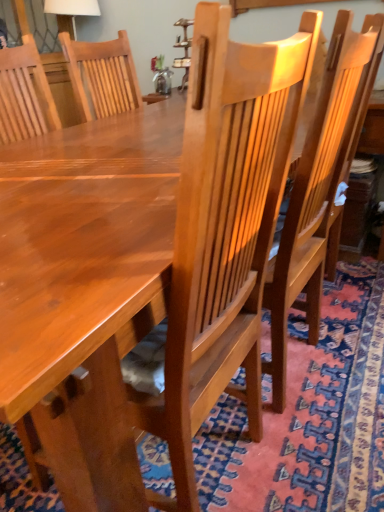
The width and height of the screenshot is (384, 512). Describe the element at coordinates (310, 415) in the screenshot. I see `carpeted floor at center` at that location.

Where is `carpeted floor at center`? This screenshot has height=512, width=384. carpeted floor at center is located at coordinates (310, 415).

This screenshot has width=384, height=512. Identify the location of glossy wood chair at center. (314, 196).

What do you see at coordinates (314, 196) in the screenshot?
I see `glossy wood chair at center` at bounding box center [314, 196].

Locate an element on the screen. The height and width of the screenshot is (512, 384). carpeted floor at center is located at coordinates click(x=310, y=415).

Is glossy wood chair at center to the left or to the right of carpeted floor at center in the image?

glossy wood chair at center is to the right of carpeted floor at center.

Which object is more forward, glossy wood chair at center or carpeted floor at center?

carpeted floor at center is closer to the camera.

Does point (279, 343) lie behind point (286, 500)?

Yes, it is.

In the scene shown: From the image's perspective, which is above, glossy wood chair at center or carpeted floor at center?

glossy wood chair at center is shown above in the image.

From a real-world perspective, is glossy wood chair at center over carpeted floor at center?

Yes.

Is glossy wood chair at center wider than carpeted floor at center?

No.

Between glossy wood chair at center and carpeted floor at center, which one has more height?

glossy wood chair at center.

Can you confirm if glossy wood chair at center is bigger than carpeted floor at center?

Actually, glossy wood chair at center might be smaller than carpeted floor at center.

Is carpeted floor at center completely or partially inside glossy wood chair at center?

No, carpeted floor at center is not inside glossy wood chair at center.

Are glossy wood chair at center and carpeted floor at center located far from each other?

No.

Is glossy wood chair at center positioned with its back to carpeted floor at center?

Yes.

In the scene shown: Can you tell me how much glossy wood chair at center and carpeted floor at center differ in facing direction?

The angle between the facing direction of glossy wood chair at center and the facing direction of carpeted floor at center is 87.7 degrees.

How far apart are glossy wood chair at center and carpeted floor at center?

They are 36.79 centimeters apart.

This screenshot has width=384, height=512. I want to click on chair lying above the carpeted floor at center (from the image's perspective), so click(314, 196).

From the picture: Considering the relative positions of carpeted floor at center and glossy wood chair at center in the image provided, is carpeted floor at center to the left of glossy wood chair at center from the viewer's perspective?

Yes.

Does carpeted floor at center lie behind glossy wood chair at center?

No, carpeted floor at center is closer to the camera.

Which is in front, point (368, 438) or point (297, 286)?

The point (368, 438) is closer.

From the image's perspective, between carpeted floor at center and glossy wood chair at center, which one is located above?

glossy wood chair at center appears higher in the image.

From a real-world perspective, who is located lower, carpeted floor at center or glossy wood chair at center?

In real-world perspective, carpeted floor at center is lower.

Looking at their sizes, would you say carpeted floor at center is wider or thinner than glossy wood chair at center?

In the image, carpeted floor at center appears to be wider than glossy wood chair at center.

Is carpeted floor at center taller than glossy wood chair at center?

No.

Between carpeted floor at center and glossy wood chair at center, which one has smaller size?

Smaller between the two is glossy wood chair at center.

Can glossy wood chair at center be found inside carpeted floor at center?

That's correct, glossy wood chair at center is inside carpeted floor at center.

Are carpeted floor at center and glossy wood chair at center beside each other?

carpeted floor at center and glossy wood chair at center are not in contact.

Is carpeted floor at center facing away from glossy wood chair at center?

No, carpeted floor at center's orientation is not away from glossy wood chair at center.

Measure the distance between carpeted floor at center and glossy wood chair at center.

The distance of carpeted floor at center from glossy wood chair at center is 14.48 inches.

You are a GUI agent. You are given a task and a screenshot of the screen. Output one action in this format:
    pyautogui.click(x=<x>, y=<y>)
    Task: Click on the chair located above the carpeted floor at center (from the image's perspective)
    The height and width of the screenshot is (512, 384).
    Given the screenshot: What is the action you would take?
    pyautogui.click(x=314, y=196)

In the image, there is a carpeted floor at center. Where is `chair above it (from the image's perspective)`? This screenshot has width=384, height=512. chair above it (from the image's perspective) is located at coordinates (314, 196).

You are a GUI agent. You are given a task and a screenshot of the screen. Output one action in this format:
    pyautogui.click(x=<x>, y=<y>)
    Task: Click on the mat in front of the glossy wood chair at center
    The width and height of the screenshot is (384, 512).
    Given the screenshot: What is the action you would take?
    [310, 415]